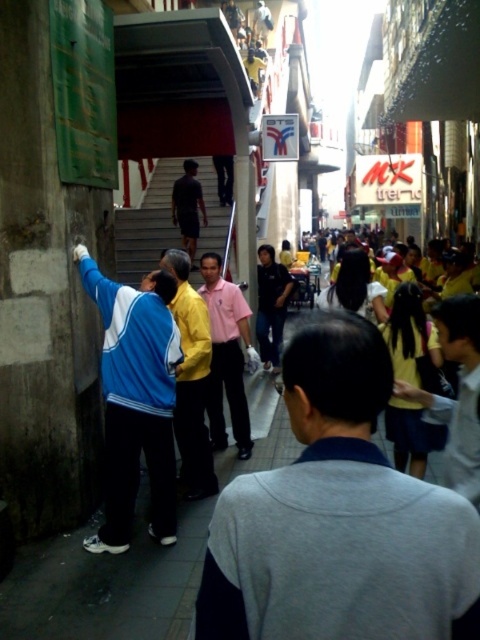
Who is lower down, gray matte jacket at center or pink smooth shirt at center?

Positioned lower is gray matte jacket at center.

Who is more forward, (472, 548) or (213, 385)?

Positioned in front is point (472, 548).

Identify the location of gray matte jacket at center. (338, 518).

Does gray matte jacket at center come behind yellow matte shirt at center?

No, it is in front of yellow matte shirt at center.

Who is more distant from viewer, (300,608) or (187,284)?

Point (187,284)

Which is in front, point (303, 456) or point (204, 360)?

Positioned in front is point (303, 456).

This screenshot has height=640, width=480. What are the coordinates of `gray matte jacket at center` in the screenshot? It's located at (338, 518).

Can you confirm if blue fabric jacket at left is positioned to the left of dark matte shirt at center?

In fact, blue fabric jacket at left is to the right of dark matte shirt at center.

Describe the element at coordinates (134, 401) in the screenshot. This screenshot has height=640, width=480. I see `blue fabric jacket at left` at that location.

At what (x,y) coordinates should I click in order to perform the action: click on blue fabric jacket at left. Please return your answer as a coordinate pair (x, y). The height and width of the screenshot is (640, 480). Looking at the image, I should click on (134, 401).